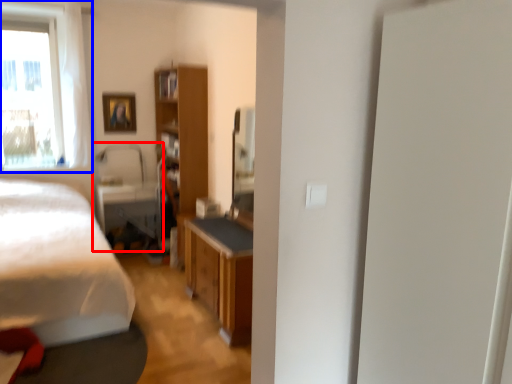
Question: Which of the following is the closest to the observer, swivel chair (highlighted by a red box) or window (highlighted by a blue box)?

Choices:
 (A) swivel chair
 (B) window

Answer: (B)